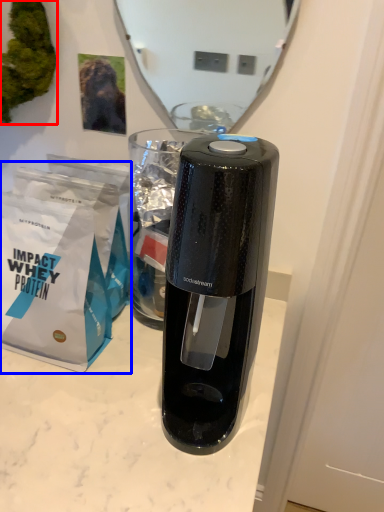
Question: Which object is further to the camera taking this photo, plant (highlighted by a red box) or paper bag (highlighted by a blue box)?

Choices:
 (A) plant
 (B) paper bag

Answer: (A)